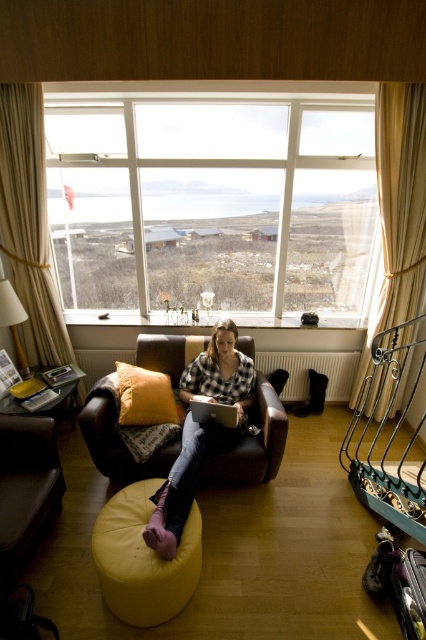
Does white glass window at center have a smaller size compared to silver metallic laptop at center?

No.

Is white glass window at center to the left of silver metallic laptop at center from the viewer's perspective?

No, white glass window at center is not to the left of silver metallic laptop at center.

What do you see at coordinates (215, 204) in the screenshot?
I see `white glass window at center` at bounding box center [215, 204].

Find the location of a particular element. white glass window at center is located at coordinates (215, 204).

Who is lower down, yellow fabric bean bag chair at center or checkered fabric shirt at center?

checkered fabric shirt at center

Image resolution: width=426 pixels, height=640 pixels. In order to click on yellow fabric bean bag chair at center in this screenshot , I will do `click(253, 445)`.

Does checkered fabric shirt at center lie behind silver metallic laptop at center?

Result: No.

Does checkered fabric shirt at center have a greater width compared to silver metallic laptop at center?

Indeed, checkered fabric shirt at center has a greater width compared to silver metallic laptop at center.

This screenshot has height=640, width=426. I want to click on checkered fabric shirt at center, so tap(201, 432).